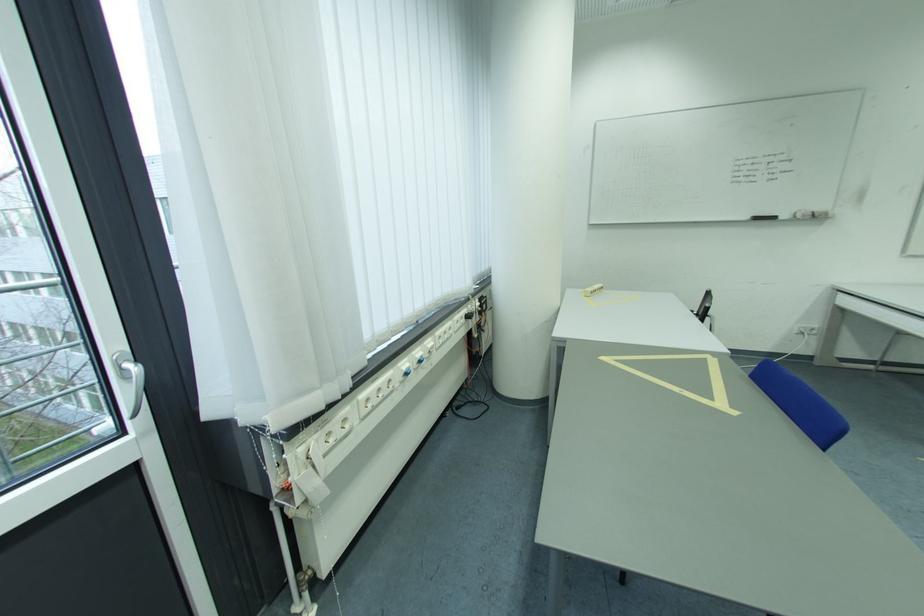
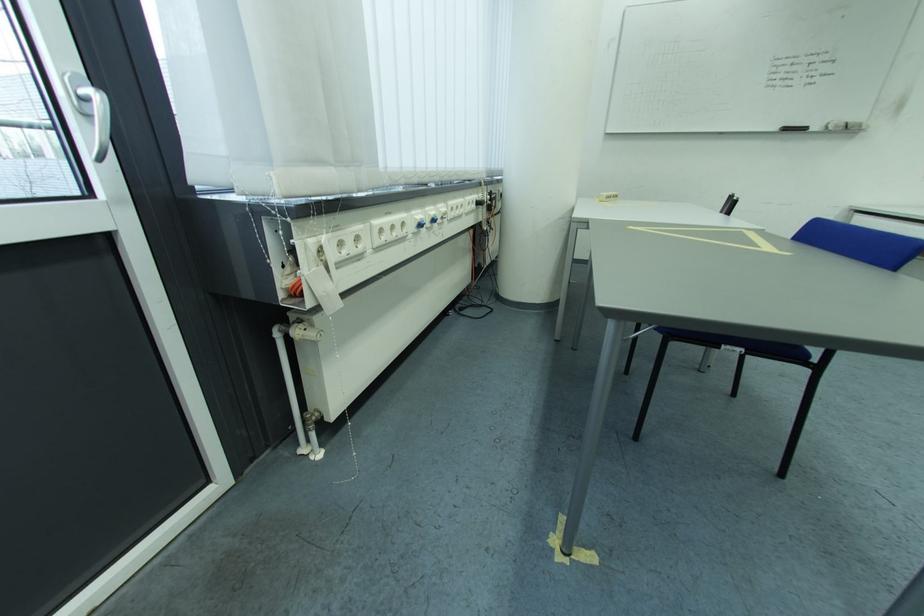
In the second image, find the point that corresponds to the point at 441,346 in the first image.

(454, 212)